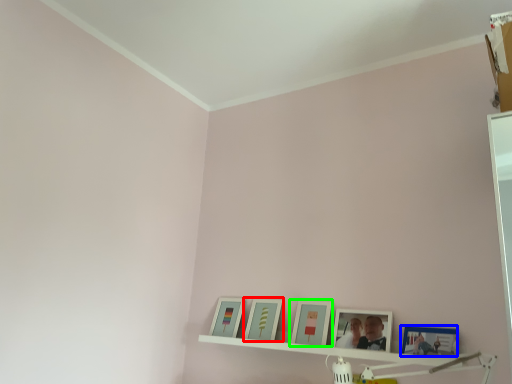
Question: Based on their relative distances, which object is farther from picture frame (highlighted by a red box)? Choose from picture frame (highlighted by a blue box) and picture frame (highlighted by a green box).

Choices:
 (A) picture frame
 (B) picture frame

Answer: (A)